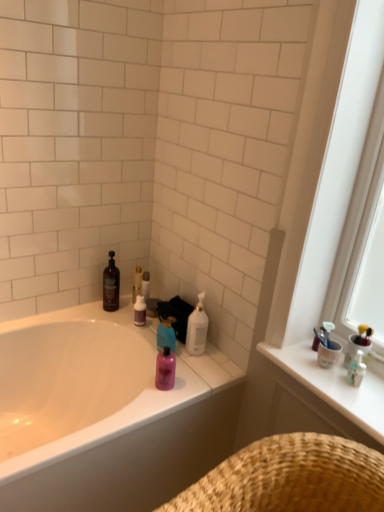
Identify the location of free space between pink glossy bottle at center, arranged as the second toiletry when viewed from the left, and white glossy bottle at upper center, which appears as the third cleaning product when viewed from the left. The image size is (384, 512). (184, 367).